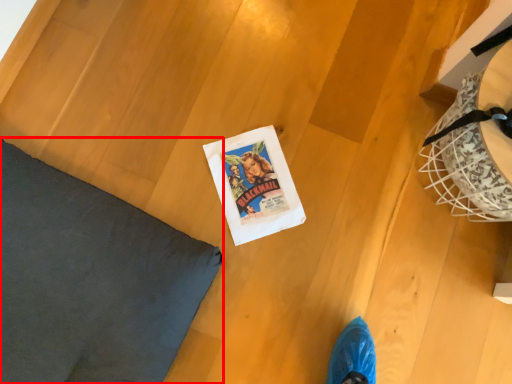
Question: Observing the image, what is the correct spatial positioning of pillow (annotated by the red box) in reference to comic book?

Choices:
 (A) right
 (B) left

Answer: (B)